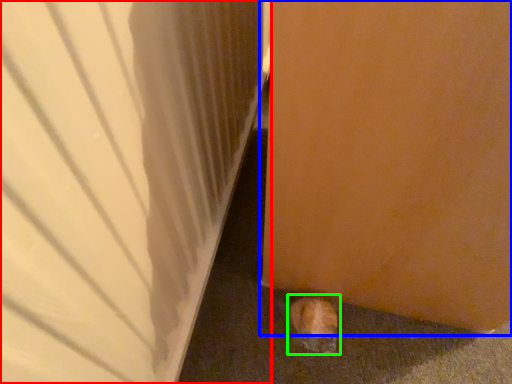
Question: Which is nearer to the door (highlighted by a red box)? door (highlighted by a blue box) or animal (highlighted by a green box).

Choices:
 (A) door
 (B) animal

Answer: (A)